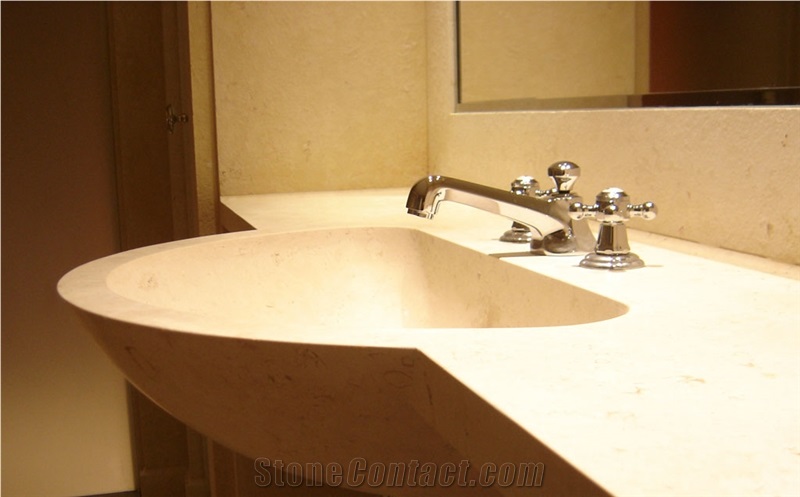
You are a GUI agent. You are given a task and a screenshot of the screen. Output one action in this format:
    pyautogui.click(x=<x>, y=<y>)
    Task: Click on the countertop
    
    Given the screenshot: What is the action you would take?
    pyautogui.click(x=550, y=394)